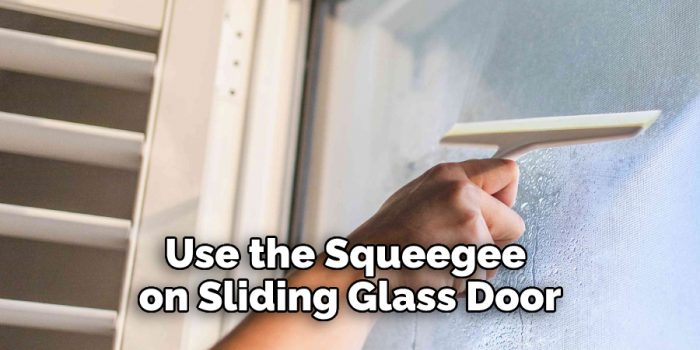
Image resolution: width=700 pixels, height=350 pixels. What are the coordinates of `screws` in the screenshot? It's located at (242, 34), (237, 62), (230, 92).